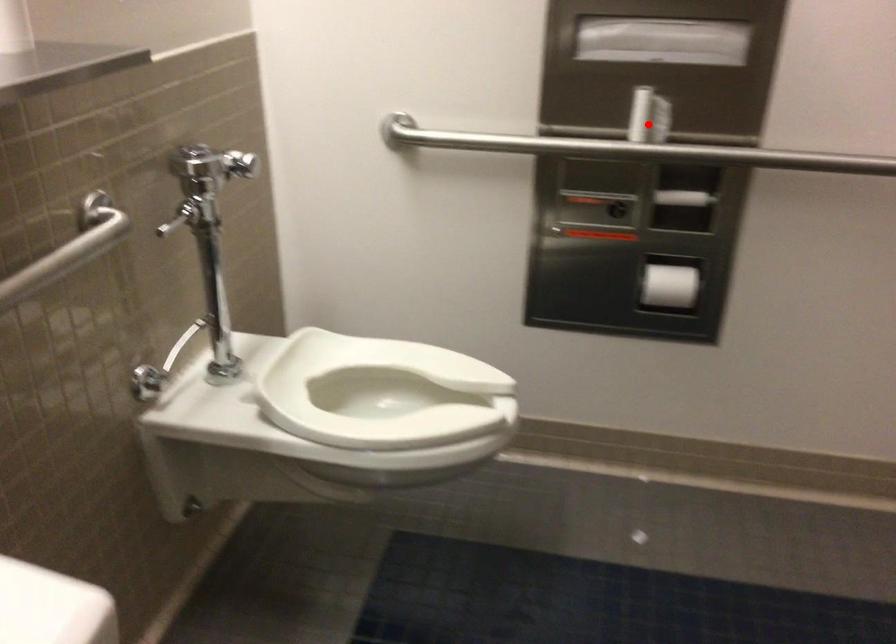
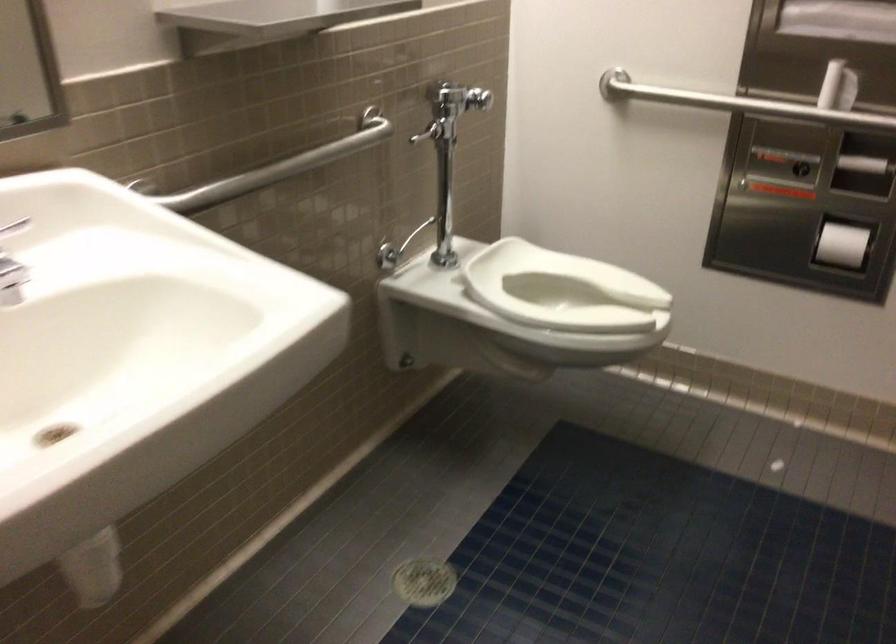
Question: A red point is marked in image1. In image2, is the corresponding 3D point closer to the camera or farther? Reply with the corresponding letter.

Choices:
 (A) The corresponding 3D point is closer.
 (B) The corresponding 3D point is farther.

Answer: (B)